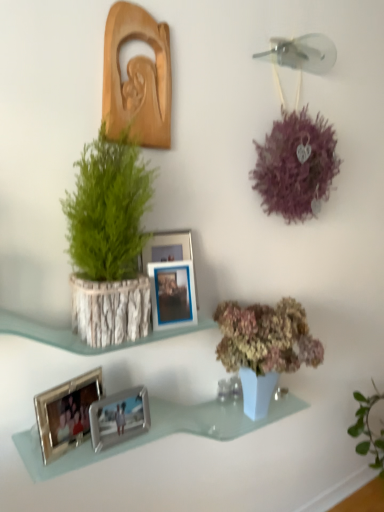
Question: Considering the positions of point (77, 389) and point (195, 318), is point (77, 389) closer or farther from the camera than point (195, 318)?

Choices:
 (A) farther
 (B) closer

Answer: (B)

Question: Is silver metallic photo frame at lower left, the second picture frame positioned from the bottom, to the left or to the right of blue metallic picture frame at center, the third picture frame when ordered from bottom to top, in the image?

Choices:
 (A) right
 (B) left

Answer: (B)

Question: Which of these objects is positioned closest to the silver metallic photo frames at lower left?

Choices:
 (A) wooden carving at upper left, positioned as the 1th picture frame in top-to-bottom order
 (B) blue metallic picture frame at center, which is the 3th picture frame in top-to-bottom order
 (C) green leafy plant in bark pot at left
 (D) silver metallic photo frame at lower left, the second picture frame positioned from the bottom
 (E) silver metallic photo frame at lower center, the 5th picture frame in the top-to-bottom sequence

Answer: (E)

Question: Which of these objects is positioned farthest from the wooden carving at upper left, positioned as the 1th picture frame in top-to-bottom order?

Choices:
 (A) silver metallic photo frames at lower left
 (B) silver metallic photo frame at lower center, marked as the 1th picture frame in a bottom-to-top arrangement
 (C) metallic silver photo frame at center, the fourth picture frame in the bottom-to-top sequence
 (D) silver metallic photo frame at lower left, which appears as the 4th picture frame when viewed from the top
 (E) blue metallic picture frame at center, which is the 3th picture frame in top-to-bottom order

Answer: (A)